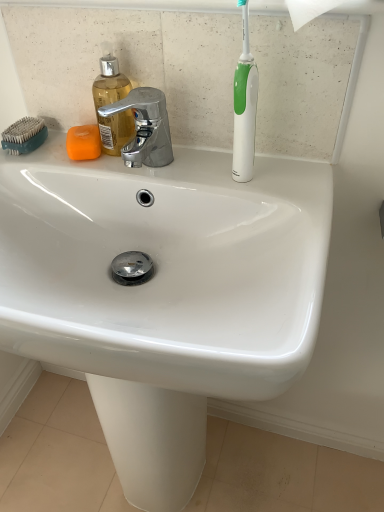
Question: Can you confirm if orange matte soap at upper left is bigger than teal plastic comb at upper left?

Choices:
 (A) yes
 (B) no

Answer: (B)

Question: Is teal plastic comb at upper left located within orange matte soap at upper left?

Choices:
 (A) no
 (B) yes

Answer: (A)

Question: Considering the relative positions of orange matte soap at upper left and teal plastic comb at upper left in the image provided, is orange matte soap at upper left to the left of teal plastic comb at upper left from the viewer's perspective?

Choices:
 (A) no
 (B) yes

Answer: (A)

Question: Is the depth of orange matte soap at upper left greater than that of teal plastic comb at upper left?

Choices:
 (A) yes
 (B) no

Answer: (B)

Question: Is orange matte soap at upper left smaller than teal plastic comb at upper left?

Choices:
 (A) no
 (B) yes

Answer: (B)

Question: Is orange matte soap at upper left oriented away from teal plastic comb at upper left?

Choices:
 (A) no
 (B) yes

Answer: (A)

Question: Considering the relative sizes of translucent plastic soap dispenser at upper left and teal plastic comb at upper left in the image provided, is translucent plastic soap dispenser at upper left bigger than teal plastic comb at upper left?

Choices:
 (A) yes
 (B) no

Answer: (A)

Question: Is translucent plastic soap dispenser at upper left completely or partially outside of teal plastic comb at upper left?

Choices:
 (A) yes
 (B) no

Answer: (A)

Question: Considering the relative sizes of translucent plastic soap dispenser at upper left and teal plastic comb at upper left in the image provided, is translucent plastic soap dispenser at upper left taller than teal plastic comb at upper left?

Choices:
 (A) no
 (B) yes

Answer: (B)

Question: Would you consider translucent plastic soap dispenser at upper left to be distant from teal plastic comb at upper left?

Choices:
 (A) yes
 (B) no

Answer: (B)

Question: Could you tell me if translucent plastic soap dispenser at upper left is facing teal plastic comb at upper left?

Choices:
 (A) no
 (B) yes

Answer: (A)

Question: From a real-world perspective, is translucent plastic soap dispenser at upper left physically above teal plastic comb at upper left?

Choices:
 (A) no
 (B) yes

Answer: (B)

Question: From the image's perspective, is orange matte soap at upper left above white glossy toothbrush at upper right?

Choices:
 (A) no
 (B) yes

Answer: (A)